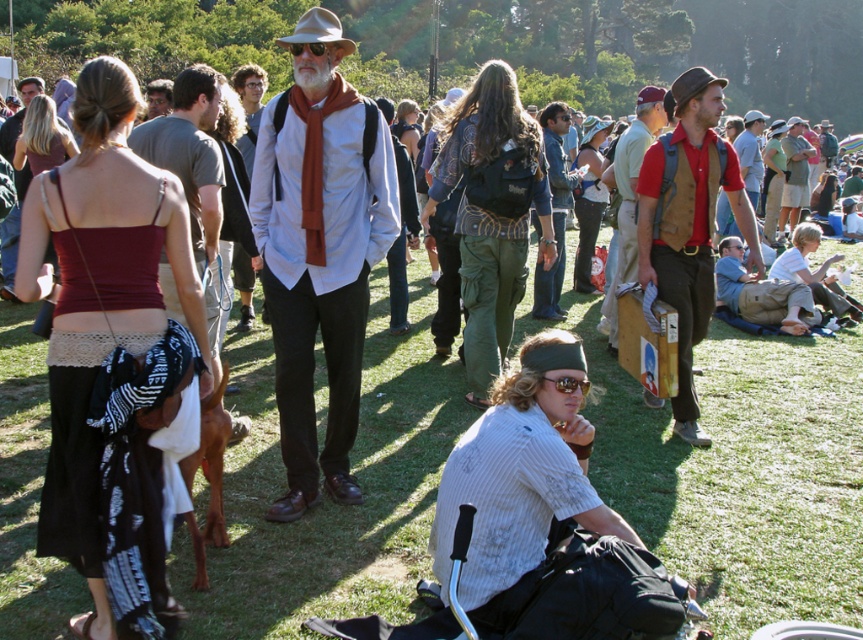
Looking at this image, can you confirm if striped shirt at lower center is bigger than red shirt and brown vest at center?

No.

Can you confirm if striped shirt at lower center is smaller than red shirt and brown vest at center?

Yes, striped shirt at lower center is smaller than red shirt and brown vest at center.

Is point (523, 538) less distant than point (631, 211)?

That is True.

At what (x,y) coordinates should I click in order to perform the action: click on striped shirt at lower center. Please return your answer as a coordinate pair (x, y). This screenshot has height=640, width=863. Looking at the image, I should click on (520, 481).

Consider the image. How distant is maroon fabric top at center from red cotton shirt at center?

A distance of 3.68 meters exists between maroon fabric top at center and red cotton shirt at center.

Is point (79, 304) closer to viewer compared to point (747, 234)?

Yes, it is in front of point (747, 234).

I want to click on maroon fabric top at center, so click(x=104, y=324).

Identify the location of maroon fabric top at center. This screenshot has width=863, height=640. (104, 324).

Between denim jacket at center and khaki cotton shirt at center, which one has less height?

With less height is denim jacket at center.

Does denim jacket at center appear on the right side of khaki cotton shirt at center?

In fact, denim jacket at center is to the left of khaki cotton shirt at center.

Is point (564, 180) positioned behind point (783, 227)?

No, (564, 180) is in front of (783, 227).

Where is `denim jacket at center`? Image resolution: width=863 pixels, height=640 pixels. denim jacket at center is located at coordinates (553, 209).